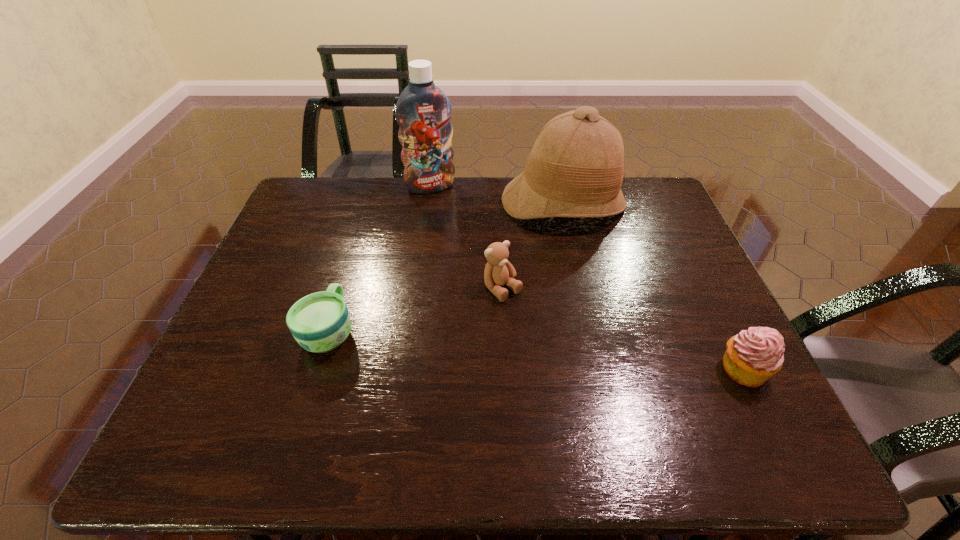
Image resolution: width=960 pixels, height=540 pixels. In order to click on vacant space at the far right corner of the desktop in this screenshot , I will do `click(639, 180)`.

Identify the location of free space between the teddy bear and the cup. (416, 310).

Where is `vacant area that lies between the rightmost object and the fourth shortest object`? This screenshot has width=960, height=540. vacant area that lies between the rightmost object and the fourth shortest object is located at coordinates (654, 286).

The height and width of the screenshot is (540, 960). I want to click on empty space that is in between the tallest object and the cup, so click(379, 259).

What are the coordinates of `unoccupied area between the rightmost object and the shortest object` in the screenshot? It's located at (537, 350).

Locate an element on the screen. free area in between the second object from left to right and the leftmost object is located at coordinates (379, 259).

Identify the location of vacant space that's between the shortest object and the fourth shortest object. (446, 267).

Locate an element on the screen. unoccupied area between the teddy bear and the leftmost object is located at coordinates (416, 310).

The image size is (960, 540). Find the location of `free space that is in between the cup and the teddy bear`. free space that is in between the cup and the teddy bear is located at coordinates (416, 310).

At what (x,y) coordinates should I click in order to perform the action: click on vacant region between the shortest object and the second object from left to right. Please return your answer as a coordinate pair (x, y). The width and height of the screenshot is (960, 540). Looking at the image, I should click on (379, 259).